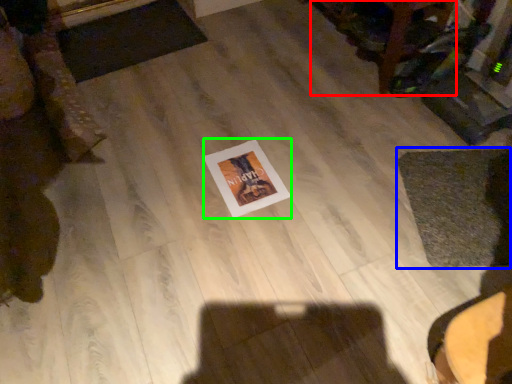
Question: Considering the real-world distances, which object is farthest from furniture (highlighted by a red box)? mat (highlighted by a blue box) or postcard (highlighted by a green box)?

Choices:
 (A) mat
 (B) postcard

Answer: (B)